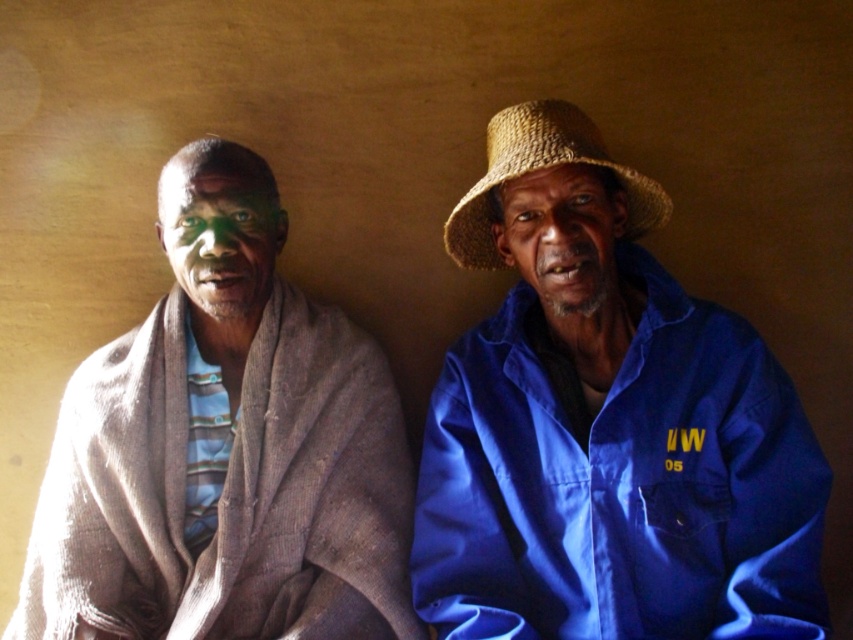
You are a photographer adjusting the camera settings to ensure both the blue fabric shirt at right and the brown straw hat at upper right are in focus. Considering their sizes, which object should you adjust the focus for first to ensure clarity?

The blue fabric shirt at right is much taller than the brown straw hat at upper right, so you should focus on the blue fabric shirt at right first since it is larger and may require more precise focus adjustment.

From the picture: You are standing in front of the two people in the image. Based on their positions, which of the two points, point 1 at coordinate (94,476) or point 2 at coordinate (589,209), is closer to you?

Point 2 at coordinate (589,209) is closer to you because point 1 at coordinate (94,476) is behind it.